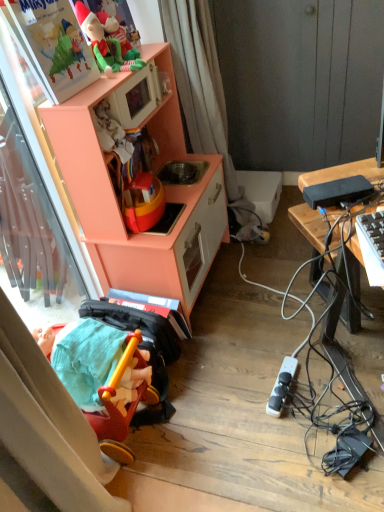
Question: Visually, is white fabric curtain at upper center positioned to the left or to the right of rubberized red tricycle at lower left, the 2th toy viewed from the top?

Choices:
 (A) right
 (B) left

Answer: (A)

Question: From the image's perspective, is white fabric curtain at upper center positioned above or below rubberized red tricycle at lower left, the 2th toy viewed from the top?

Choices:
 (A) below
 (B) above

Answer: (B)

Question: Which object is the farthest from the black plastic power bank at right, the first appliance in the top-to-bottom sequence?

Choices:
 (A) peach wood toy kitchen at left
 (B) white fabric curtain at upper center
 (C) black plastic desk at right
 (D) matte plastic elf at upper left, the 2th toy ordered from the bottom
 (E) black plastic power strip at lower right, positioned as the 1th appliance in bottom-to-top order

Answer: (B)

Question: Which object is positioned closest to the rubberized red tricycle at lower left, the 1th toy when ordered from bottom to top?

Choices:
 (A) black plastic power strip at lower right, acting as the 1th appliance starting from the back
 (B) white fabric curtain at upper center
 (C) peach wood toy kitchen at left
 (D) black plastic desk at right
 (E) black plastic power bank at right, the first appliance in the top-to-bottom sequence

Answer: (A)